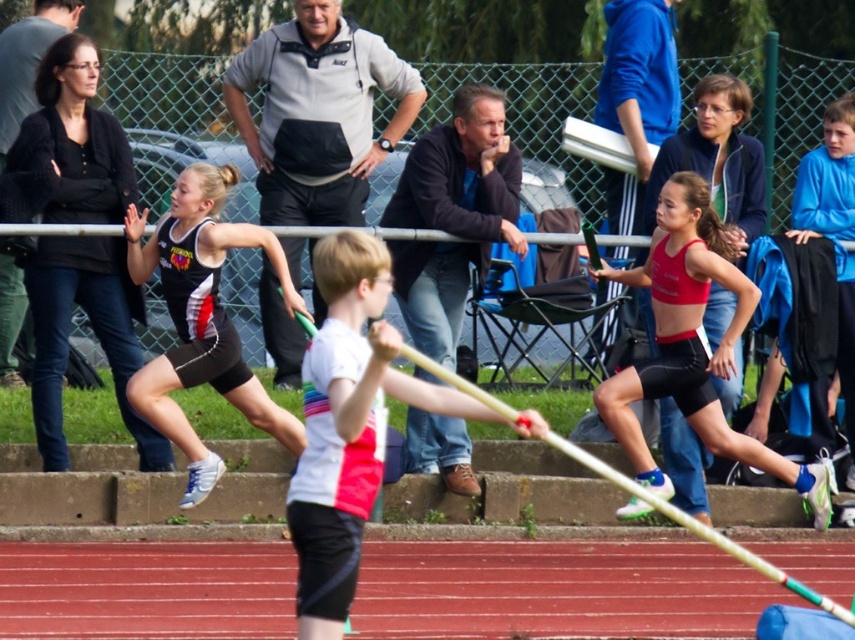
Question: Can you confirm if matte red crop top at center is thinner than black matte shorts at left?

Choices:
 (A) yes
 (B) no

Answer: (B)

Question: Among these objects, which one is farthest from the camera?

Choices:
 (A) white/red striped shirt at center
 (B) black matte shorts at left

Answer: (B)

Question: Which object appears closest to the camera in this image?

Choices:
 (A) matte red crop top at center
 (B) black matte shorts at left
 (C) white/red striped shirt at center

Answer: (C)

Question: Can you confirm if white/red striped shirt at center is bigger than black matte shorts at left?

Choices:
 (A) yes
 (B) no

Answer: (B)

Question: Which of the following is the farthest from the observer?

Choices:
 (A) matte red crop top at center
 (B) white/red striped shirt at center

Answer: (A)

Question: Does white/red striped shirt at center have a greater width compared to black matte shorts at left?

Choices:
 (A) yes
 (B) no

Answer: (B)